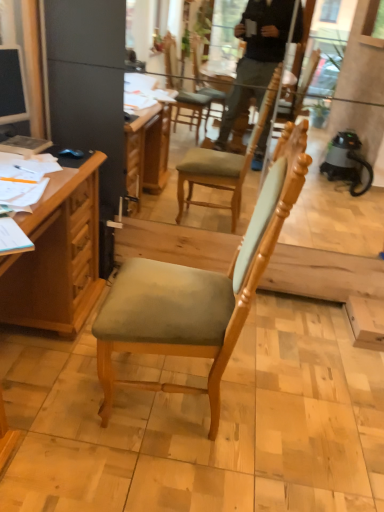
Question: Is hardcover book at left in front of or behind blue matte computer mouse at upper left in the image?

Choices:
 (A) front
 (B) behind

Answer: (A)

Question: Do you think hardcover book at left is within blue matte computer mouse at upper left, or outside of it?

Choices:
 (A) outside
 (B) inside

Answer: (A)

Question: Estimate the real-world distances between objects in this image. Which object is closer to the wooden desk at left?

Choices:
 (A) hardcover book at left
 (B) blue matte computer mouse at upper left
 (C) matte black monitor at left
 (D) light brown wood chair at center

Answer: (B)

Question: Which is nearer to the matte black monitor at left?

Choices:
 (A) hardcover book at left
 (B) light brown wood chair at center
 (C) wooden desk at left
 (D) blue matte computer mouse at upper left

Answer: (A)